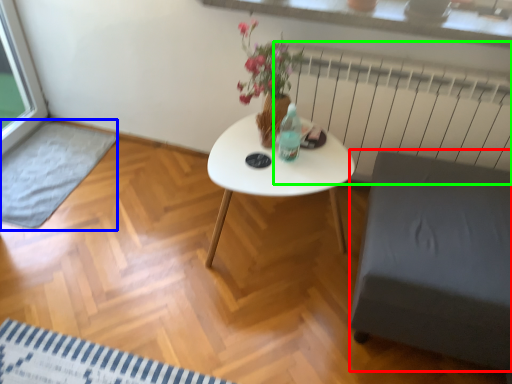
Question: Which is nearer to the armchair (highlighted by a red box)? wide (highlighted by a blue box) or radiator (highlighted by a green box).

Choices:
 (A) wide
 (B) radiator

Answer: (B)